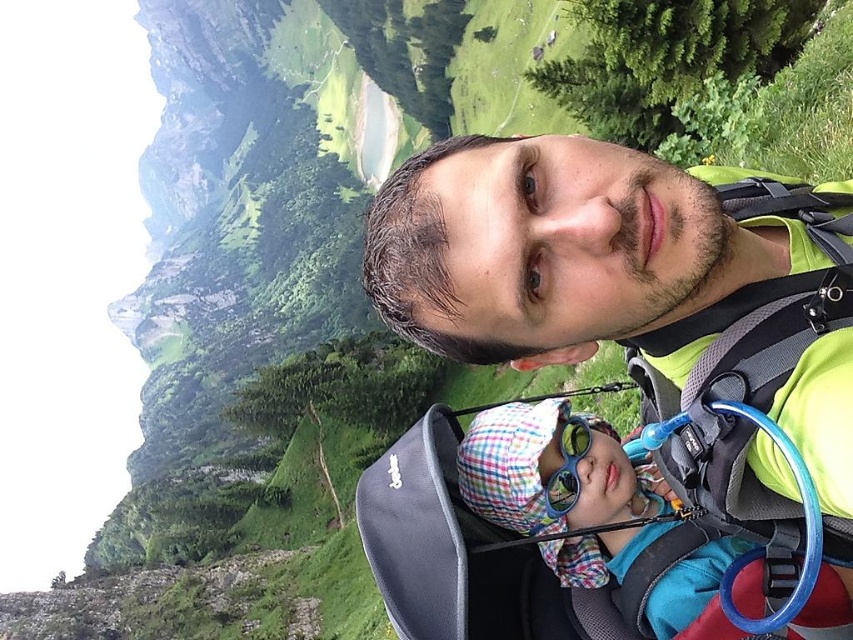
Question: Does matte green shirt at upper center appear under plaid fabric hat at lower center?

Choices:
 (A) no
 (B) yes

Answer: (A)

Question: Is matte green shirt at upper center to the left of plaid fabric hat at lower center from the viewer's perspective?

Choices:
 (A) no
 (B) yes

Answer: (A)

Question: Is matte green shirt at upper center further to the viewer compared to plaid fabric hat at lower center?

Choices:
 (A) yes
 (B) no

Answer: (B)

Question: Among these objects, which one is farthest from the camera?

Choices:
 (A) plaid fabric hat at lower center
 (B) matte green shirt at upper center

Answer: (A)

Question: Which object is farther from the camera taking this photo?

Choices:
 (A) matte green shirt at upper center
 (B) plaid fabric hat at lower center

Answer: (B)